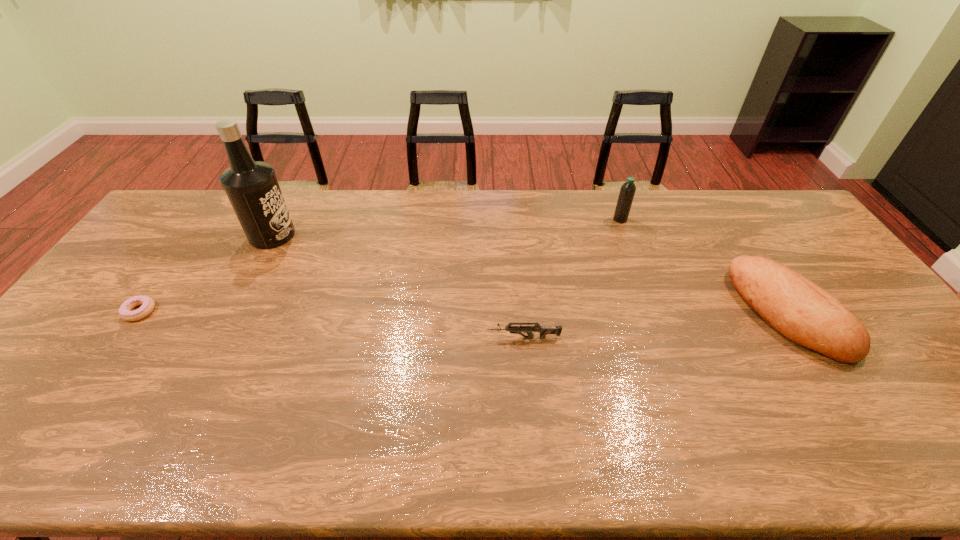
Where is `free spot located on the front label of the tallest object`? The width and height of the screenshot is (960, 540). free spot located on the front label of the tallest object is located at coordinates (379, 235).

Where is `free spot located on the front of the water bottle`? This screenshot has height=540, width=960. free spot located on the front of the water bottle is located at coordinates 636,264.

Find the location of a particular element. The width and height of the screenshot is (960, 540). free point located 0.110m on the back of the third tallest object is located at coordinates (745, 245).

You are a GUI agent. You are given a task and a screenshot of the screen. Output one action in this format:
    pyautogui.click(x=<x>, y=<y>)
    Task: Click on the vacant space located aimed along the barrel of the fourth tallest object
    
    Given the screenshot: What is the action you would take?
    pyautogui.click(x=420, y=338)

The image size is (960, 540). What are the coordinates of `vacant region located aimed along the barrel of the fourth tallest object` in the screenshot? It's located at (446, 338).

You are a GUI agent. You are given a task and a screenshot of the screen. Output one action in this format:
    pyautogui.click(x=<x>, y=<y>)
    Task: Click on the vacant area located 0.350m aimed along the barrel of the fourth tallest object
    This screenshot has height=540, width=960.
    Given the screenshot: What is the action you would take?
    pyautogui.click(x=355, y=338)

Find the location of `free space located on the right of the doughnut`. free space located on the right of the doughnut is located at coordinates (252, 311).

Where is `liquor that is positioned at the far edge`? liquor that is positioned at the far edge is located at coordinates (252, 188).

Locate an element on the screen. This screenshot has height=540, width=960. water bottle positioned at the far edge is located at coordinates (627, 191).

You are a GUI agent. You are given a task and a screenshot of the screen. Output one action in this format:
    pyautogui.click(x=<x>, y=<y>)
    Task: Click on the object positioned at the left edge
    The height and width of the screenshot is (540, 960).
    Given the screenshot: What is the action you would take?
    pyautogui.click(x=148, y=304)